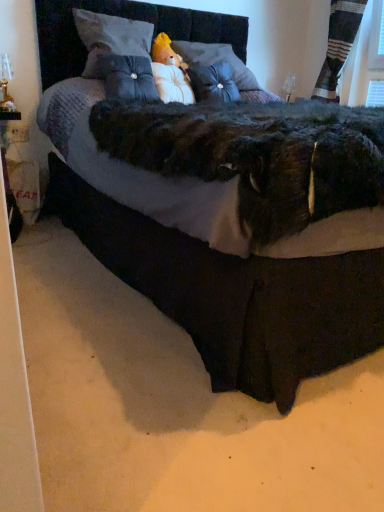
Question: From the image's perspective, is white plush doll at lower left below striped fabric curtain at upper right?

Choices:
 (A) no
 (B) yes

Answer: (B)

Question: From a real-world perspective, is white plush doll at lower left positioned under striped fabric curtain at upper right based on gravity?

Choices:
 (A) yes
 (B) no

Answer: (A)

Question: Is white plush doll at lower left further to camera compared to striped fabric curtain at upper right?

Choices:
 (A) no
 (B) yes

Answer: (A)

Question: Can you confirm if white plush doll at lower left is smaller than striped fabric curtain at upper right?

Choices:
 (A) no
 (B) yes

Answer: (B)

Question: Does white plush doll at lower left have a greater width compared to striped fabric curtain at upper right?

Choices:
 (A) no
 (B) yes

Answer: (A)

Question: Is white plush doll at lower left thinner than striped fabric curtain at upper right?

Choices:
 (A) yes
 (B) no

Answer: (A)

Question: Is velvet black bed at center smaller than white plush at center, which is the third pillow in left-to-right order?

Choices:
 (A) no
 (B) yes

Answer: (A)

Question: From a real-world perspective, is velvet black bed at center physically above white plush at center, which is the third pillow in left-to-right order?

Choices:
 (A) yes
 (B) no

Answer: (B)

Question: Is velvet black bed at center aimed at white plush at center, which is the third pillow in left-to-right order?

Choices:
 (A) yes
 (B) no

Answer: (B)

Question: Does velvet black bed at center lie behind white plush at center, which is the third pillow in left-to-right order?

Choices:
 (A) yes
 (B) no

Answer: (B)

Question: Is the position of velvet black bed at center less distant than that of white plush at center, the second pillow positioned from the right?

Choices:
 (A) yes
 (B) no

Answer: (A)

Question: Is there a large distance between velvet black bed at center and white plush at center, which is the third pillow in left-to-right order?

Choices:
 (A) yes
 (B) no

Answer: (B)

Question: Is velvet black bed at center located within striped fabric curtain at upper right?

Choices:
 (A) no
 (B) yes

Answer: (A)